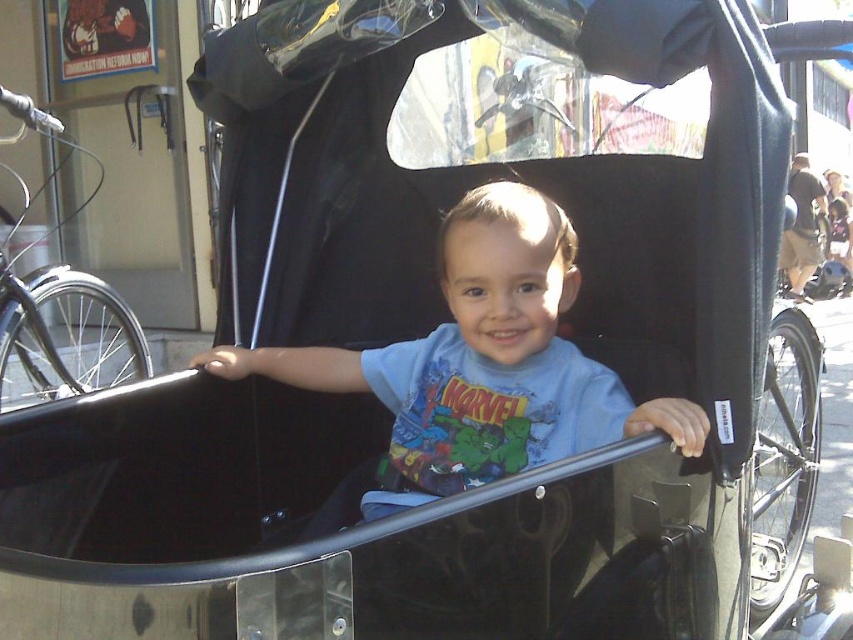
Is point (468, 300) farther from camera compared to point (808, 241)?

No, it is not.

Which is more to the left, light blue cotton shirt at center or brown fabric coach at right?

Positioned to the left is light blue cotton shirt at center.

Image resolution: width=853 pixels, height=640 pixels. What are the coordinates of `light blue cotton shirt at center` in the screenshot? It's located at (476, 369).